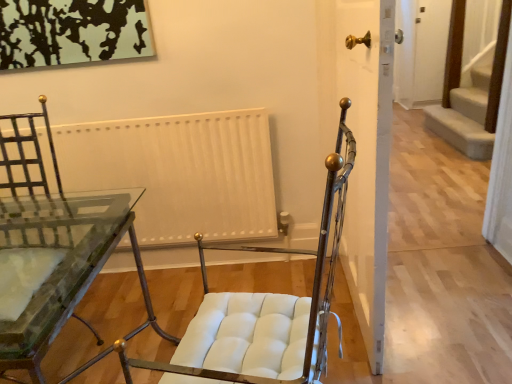
Question: Is clear glass table at center wider than white matte radiator at center?

Choices:
 (A) yes
 (B) no

Answer: (A)

Question: Is clear glass table at center turned away from white matte radiator at center?

Choices:
 (A) yes
 (B) no

Answer: (A)

Question: From a real-world perspective, is clear glass table at center located beneath white matte radiator at center?

Choices:
 (A) no
 (B) yes

Answer: (B)

Question: Does clear glass table at center have a lesser width compared to white matte radiator at center?

Choices:
 (A) yes
 (B) no

Answer: (B)

Question: Could you tell me if clear glass table at center is turned towards white matte radiator at center?

Choices:
 (A) no
 (B) yes

Answer: (A)

Question: From the image's perspective, is clear glass table at center located beneath white matte radiator at center?

Choices:
 (A) yes
 (B) no

Answer: (A)

Question: Does white matte radiator at center lie in front of white matte door at center?

Choices:
 (A) yes
 (B) no

Answer: (B)

Question: Considering the relative positions of white matte radiator at center and white matte door at center in the image provided, is white matte radiator at center to the left of white matte door at center from the viewer's perspective?

Choices:
 (A) yes
 (B) no

Answer: (A)

Question: Does white matte radiator at center have a lesser width compared to white matte door at center?

Choices:
 (A) yes
 (B) no

Answer: (A)

Question: Is white matte radiator at center wider than white matte door at center?

Choices:
 (A) no
 (B) yes

Answer: (A)

Question: Could you tell me if white matte radiator at center is facing white matte door at center?

Choices:
 (A) yes
 (B) no

Answer: (B)

Question: From the image's perspective, is white matte radiator at center above white matte door at center?

Choices:
 (A) no
 (B) yes

Answer: (A)

Question: Does white matte radiator at center have a greater width compared to clear glass table at center?

Choices:
 (A) no
 (B) yes

Answer: (A)